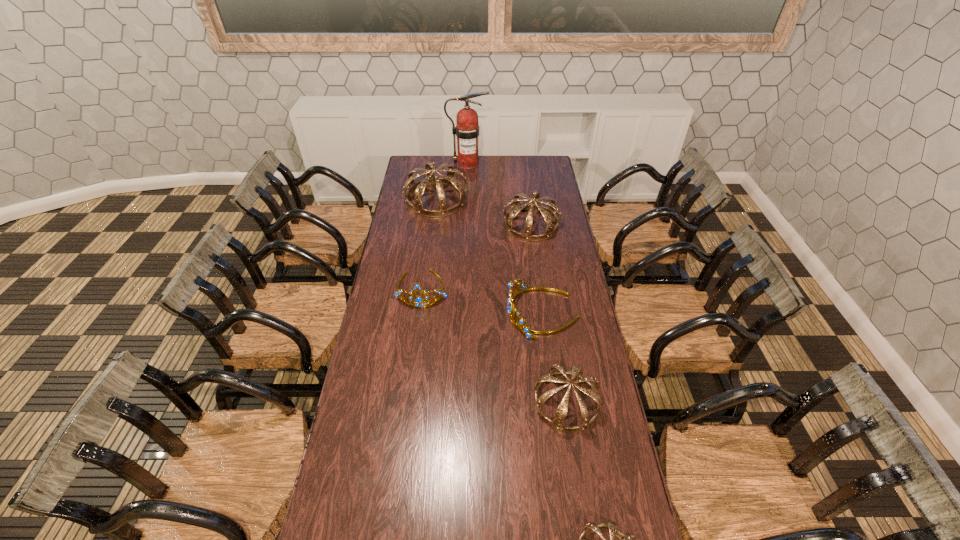
Where is `vacant area situated 0.280m on the front of the leftmost brown tiara`? The image size is (960, 540). vacant area situated 0.280m on the front of the leftmost brown tiara is located at coordinates (430, 253).

Where is `vacant space situated on the back of the second biggest brown tiara`? The height and width of the screenshot is (540, 960). vacant space situated on the back of the second biggest brown tiara is located at coordinates (524, 173).

Image resolution: width=960 pixels, height=540 pixels. I want to click on vacant area situated 0.390m on the front-facing side of the bigger gold tiara, so click(x=413, y=313).

Locate an element on the screen. The height and width of the screenshot is (540, 960). vacant space located 0.360m on the front-facing side of the bigger gold tiara is located at coordinates (420, 313).

Image resolution: width=960 pixels, height=540 pixels. Find the location of `vacant space located 0.290m on the front-facing side of the bigger gold tiara`. vacant space located 0.290m on the front-facing side of the bigger gold tiara is located at coordinates (437, 313).

Identify the location of vacant point located on the back of the second nearest tiara. This screenshot has width=960, height=540. (555, 333).

This screenshot has width=960, height=540. Identify the location of blank space located on the front-facing side of the smaller gold tiara. (413, 365).

Where is `object located at the far edge`? object located at the far edge is located at coordinates click(x=467, y=130).

In the image, there is a desktop. Identify the location of free space at the far edge. This screenshot has height=540, width=960. (521, 164).

In the image, there is a desktop. Where is `vacant space at the left edge`? The image size is (960, 540). vacant space at the left edge is located at coordinates (406, 236).